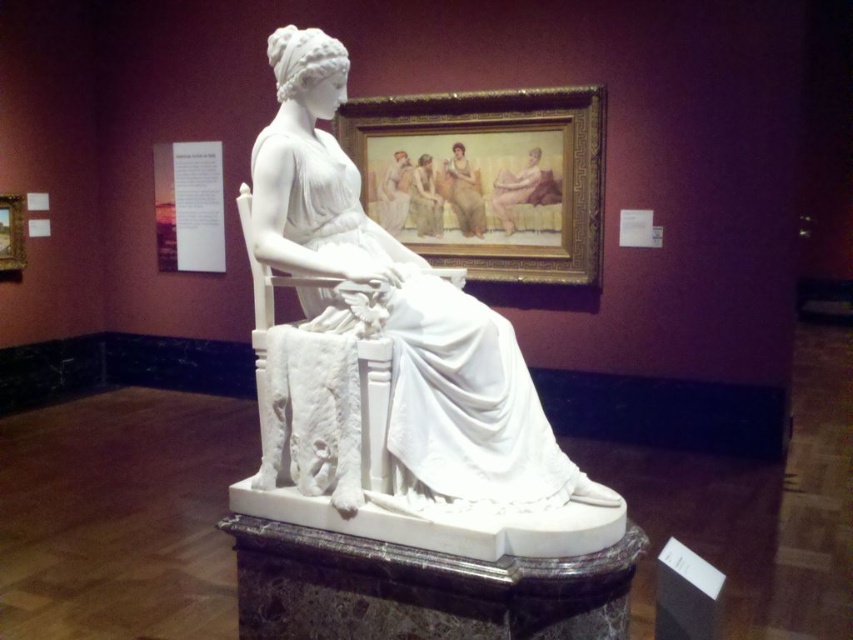
This screenshot has height=640, width=853. In order to click on smooth beige fabric at upper center in this screenshot , I will do `click(463, 193)`.

Does smooth beige fabric at upper center have a lesser width compared to matte white figure at center?

No, smooth beige fabric at upper center is not thinner than matte white figure at center.

The height and width of the screenshot is (640, 853). In order to click on smooth beige fabric at upper center in this screenshot , I will do `click(463, 193)`.

Can you confirm if white marble dress at center is taller than matte white figure at center?

Yes.

What do you see at coordinates (416, 339) in the screenshot?
I see `white marble dress at center` at bounding box center [416, 339].

Identify the location of white marble dress at center. This screenshot has width=853, height=640. coord(416,339).

The image size is (853, 640). Identify the location of white marble dress at center. (416, 339).

Does smooth beige skin at upper center have a greater width compared to matte white figure at center?

Yes.

Can you confirm if smooth beige skin at upper center is smaller than matte white figure at center?

Incorrect, smooth beige skin at upper center is not smaller in size than matte white figure at center.

In order to click on smooth beige skin at upper center in this screenshot , I will do `click(515, 189)`.

I want to click on smooth beige skin at upper center, so click(515, 189).